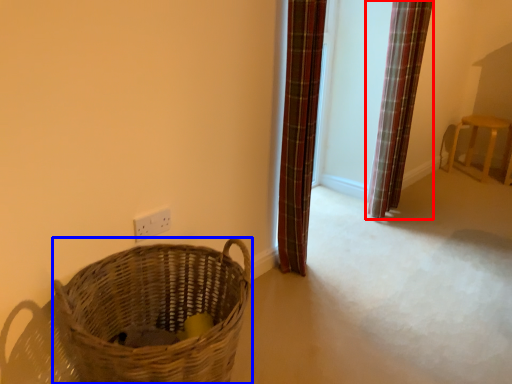
Question: Which object is further to the camera taking this photo, curtain (highlighted by a red box) or basket (highlighted by a blue box)?

Choices:
 (A) curtain
 (B) basket

Answer: (A)